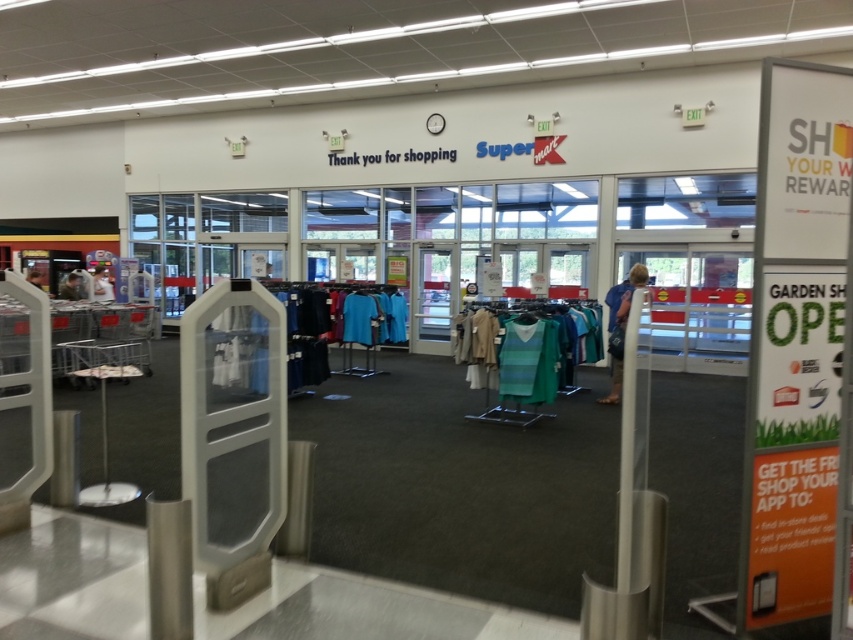
Who is positioned more to the right, striped knit sweater at center or blue denim jeans at center?

From the viewer's perspective, blue denim jeans at center appears more on the right side.

Is point (566, 344) less distant than point (633, 289)?

Yes.

This screenshot has width=853, height=640. Find the location of `striped knit sweater at center`. striped knit sweater at center is located at coordinates (544, 349).

Looking at this image, can you confirm if striped knit sweater at center is positioned above blue fabric dress at center?

No.

Can you confirm if striped knit sweater at center is positioned below blue fabric dress at center?

Yes.

Who is more forward, (556,339) or (608,314)?

Point (556,339) is in front.

In order to click on striped knit sweater at center in this screenshot , I will do `click(544, 349)`.

Between point (497, 316) and point (546, 362), which one is positioned behind?

Positioned behind is point (497, 316).

Is striped knit sweater at center wider than green knitted sweater at center?

Indeed, striped knit sweater at center has a greater width compared to green knitted sweater at center.

Image resolution: width=853 pixels, height=640 pixels. Find the location of `striped knit sweater at center`. striped knit sweater at center is located at coordinates (544, 349).